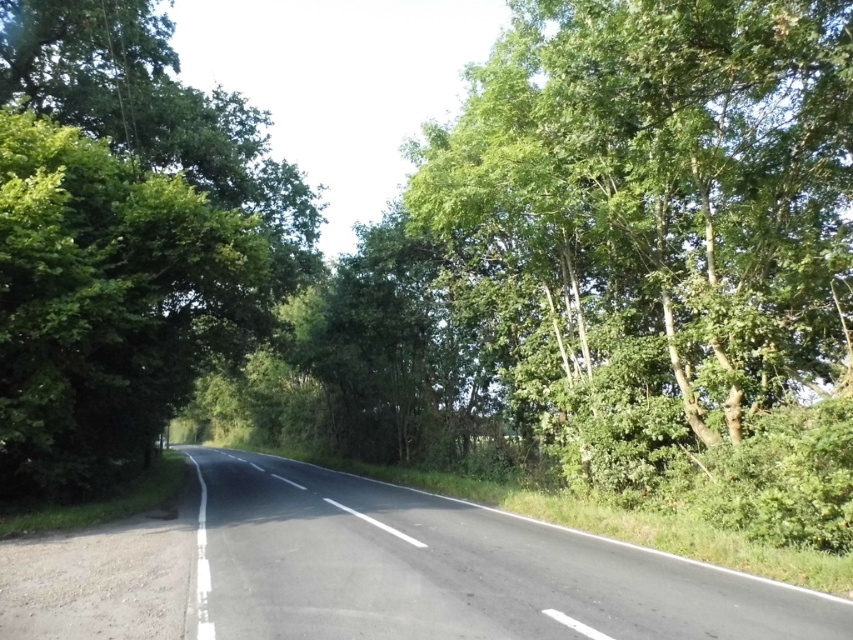
Can you confirm if green leafy tree at right is bigger than green leafy tree at left?

Incorrect, green leafy tree at right is not larger than green leafy tree at left.

Who is more distant from viewer, [579,406] or [9,321]?

Positioned behind is point [579,406].

Is point (561, 86) positioned after point (90, 280)?

No, it is in front of (90, 280).

Find the location of a particular element. Image resolution: width=853 pixels, height=640 pixels. green leafy tree at right is located at coordinates (654, 218).

Does green leafy tree at right have a larger size compared to black asphalt road at center?

Actually, green leafy tree at right might be smaller than black asphalt road at center.

Between point (726, 404) and point (421, 561), which one is positioned in front?

Point (421, 561)

Does point (637, 51) come closer to viewer compared to point (589, 557)?

Yes, point (637, 51) is closer to viewer.

Locate an element on the screen. green leafy tree at right is located at coordinates (654, 218).

Consider the image. Which is more to the right, green leafy tree at left or black asphalt road at center?

black asphalt road at center is more to the right.

Is green leafy tree at left taller than black asphalt road at center?

Indeed, green leafy tree at left has a greater height compared to black asphalt road at center.

Who is more distant from viewer, (223,134) or (279,616)?

Point (223,134)

Identify the location of green leafy tree at left. (125, 236).